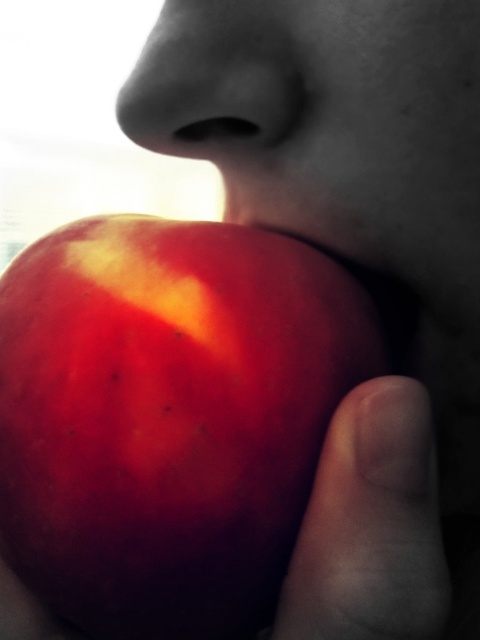
Question: In this image, where is shiny red apple at mouth located relative to smooth skin finger at lower right?

Choices:
 (A) below
 (B) above

Answer: (B)

Question: Which of the following is the farthest from the observer?

Choices:
 (A) (418, 593)
 (B) (199, 420)

Answer: (B)

Question: Which of the following is the farthest from the observer?

Choices:
 (A) (430, 520)
 (B) (110, 529)

Answer: (A)

Question: Is shiny red apple at mouth closer to the viewer compared to smooth skin finger at lower right?

Choices:
 (A) yes
 (B) no

Answer: (B)

Question: Where is shiny red apple at mouth located in relation to smooth skin finger at lower right in the image?

Choices:
 (A) left
 (B) right

Answer: (A)